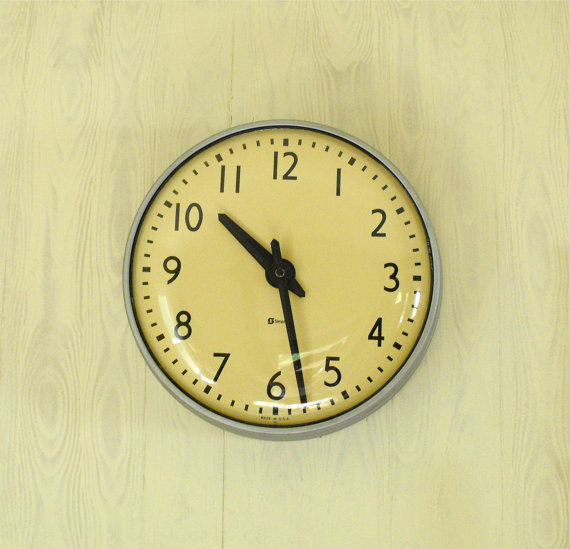
Where is `grey border of clock`? The image size is (570, 549). grey border of clock is located at coordinates (185, 400), (315, 128).